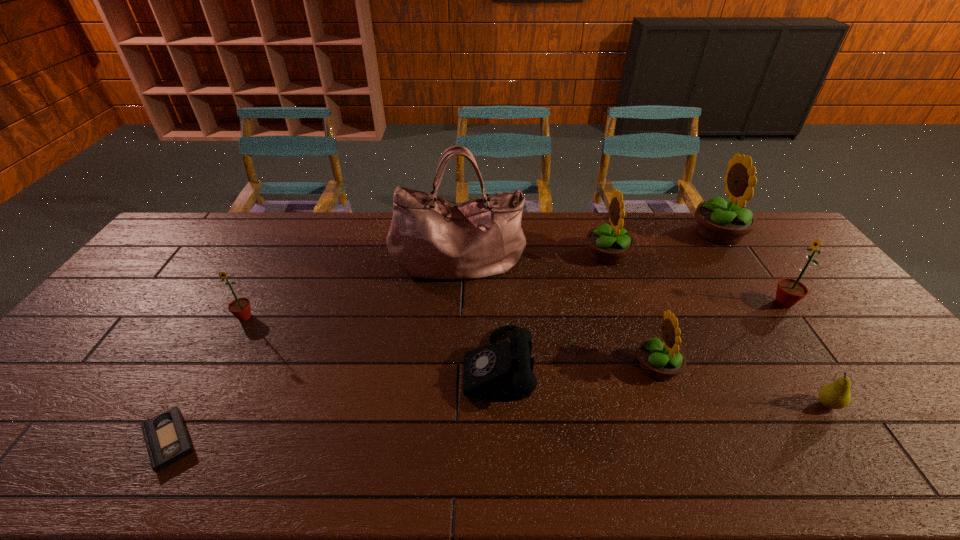
I want to click on handbag, so click(430, 237).

Locate an element on the screen. This screenshot has width=960, height=540. the biggest yellow sunflower is located at coordinates (720, 221).

Find the location of a particular element. the rightmost yellow sunflower is located at coordinates (720, 221).

Locate an element on the screen. This screenshot has height=540, width=960. the second smallest yellow sunflower is located at coordinates (610, 245).

Locate an element on the screen. the right green sunflower is located at coordinates (789, 291).

Where is `the nearest yellow sunflower`? The width and height of the screenshot is (960, 540). the nearest yellow sunflower is located at coordinates (661, 359).

Locate an element on the screen. This screenshot has width=960, height=540. the smallest yellow sunflower is located at coordinates (661, 359).

Where is `the leftmost sunflower`? Image resolution: width=960 pixels, height=540 pixels. the leftmost sunflower is located at coordinates (240, 308).

This screenshot has width=960, height=540. In order to click on the smaller green sunflower in this screenshot , I will do `click(240, 308)`.

Where is `pear`? pear is located at coordinates (836, 395).